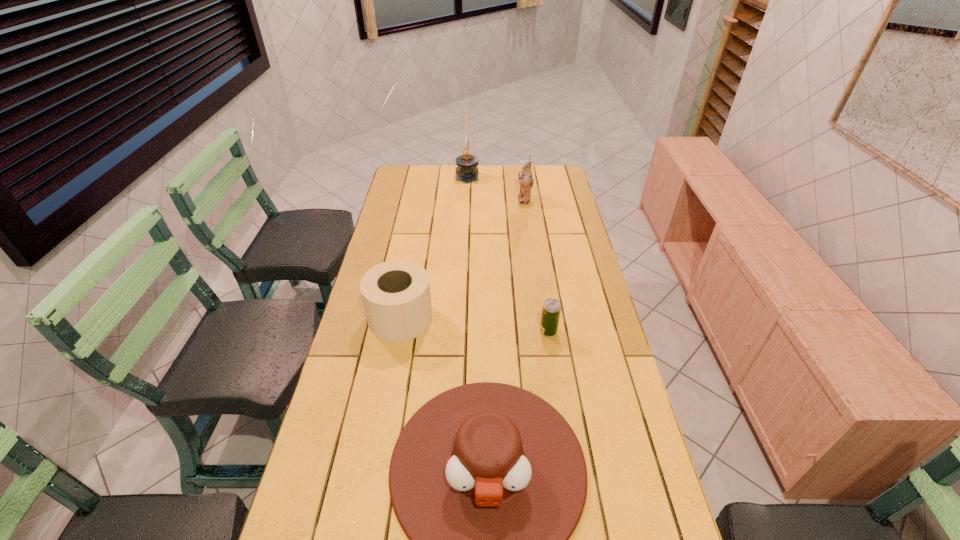
I want to click on free space between the toilet tissue and the oil lamp, so click(434, 247).

This screenshot has width=960, height=540. I want to click on vacant area that lies between the figurine and the farthest object, so click(495, 187).

This screenshot has height=540, width=960. In order to click on free point between the toilet tissue and the figurine in this screenshot , I will do `click(463, 258)`.

Image resolution: width=960 pixels, height=540 pixels. Identify the location of the closest object to the toilet tissue. (488, 481).

Identify which object is the second nearest to the cowboy hat. Please provide its 2D coordinates. Your answer should be formatted as a tuple, i.e. [(x, y)], where the tuple contains the x and y coordinates of a point satisfying the conditions above.

[(551, 310)]

Identify the location of vacant space that satisfies the following two spatial constraints: 1. on the front-facing side of the beer can; 2. on the left side of the fourth nearest object. (543, 331).